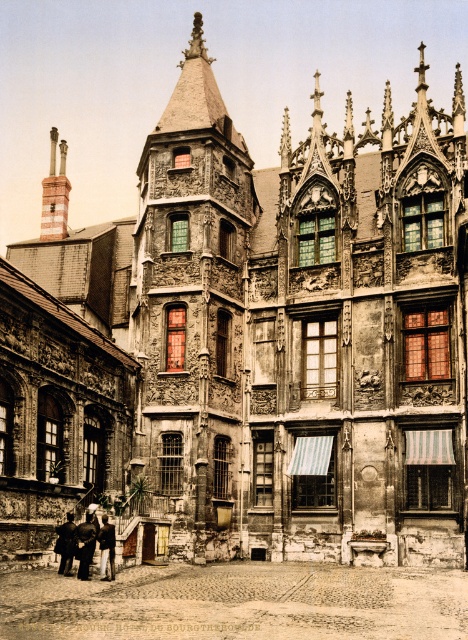
Consider the image. You are a delivery person standing in front of the historic building and need to place a package between the dark wool coat at lower left and the dark brown leather coat at lower left. Can you fit the package if it requires 30 inches of space?

The dark wool coat at lower left and dark brown leather coat at lower left are 33.40 inches apart, so yes, the package requiring 30 inches of space can fit between them.

You are standing in front of the historic building and notice two coats hanging on a rack at the lower left. Which coat is closer to you, the dark wool coat at lower left or the dark brown leather coat at lower left?

The dark wool coat at lower left is closer to you because it is further to the viewer than the dark brown leather coat at lower left.

You are a tailor who needs to determine which piece of clothing to alter first. You have a dark brown leather coat at lower left and a dark brown leather jacket at lower left in front of you. Which one requires more fabric adjustments due to its larger size?

The dark brown leather coat at lower left requires more fabric adjustments because its width surpasses that of the dark brown leather jacket at lower left.